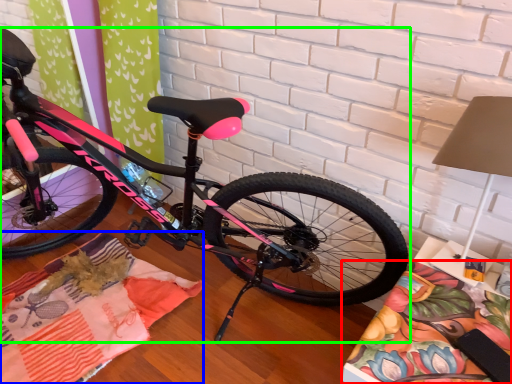
Question: Which object is the farthest from blanket (highlighted by a red box)? Choose among these: blanket (highlighted by a blue box) or bicycle (highlighted by a green box).

Choices:
 (A) blanket
 (B) bicycle

Answer: (A)